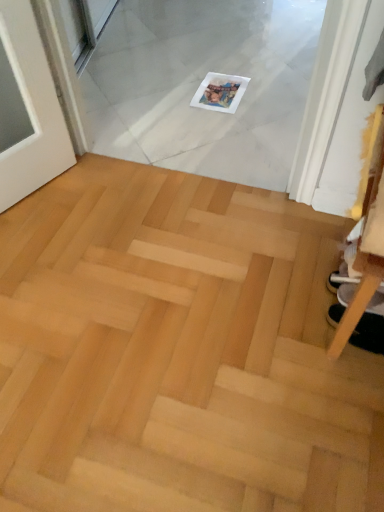
Find the location of a particular element. This screenshot has width=384, height=512. empty space that is ontop of natural wood parquet floor at center (from a real-world perspective) is located at coordinates (163, 305).